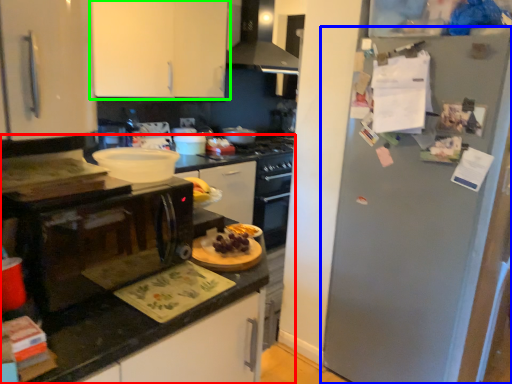
Question: Which object is the farthest from countertop (highlighted by a red box)? Choose among these: refrigerator (highlighted by a blue box) or cabinetry (highlighted by a green box).

Choices:
 (A) refrigerator
 (B) cabinetry

Answer: (B)